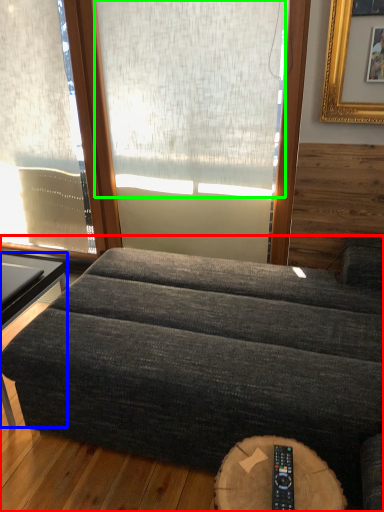
Question: Considering the real-world distances, which object is farthest from studio couch (highlighted by a red box)? table (highlighted by a blue box) or window screen (highlighted by a green box)?

Choices:
 (A) table
 (B) window screen

Answer: (B)